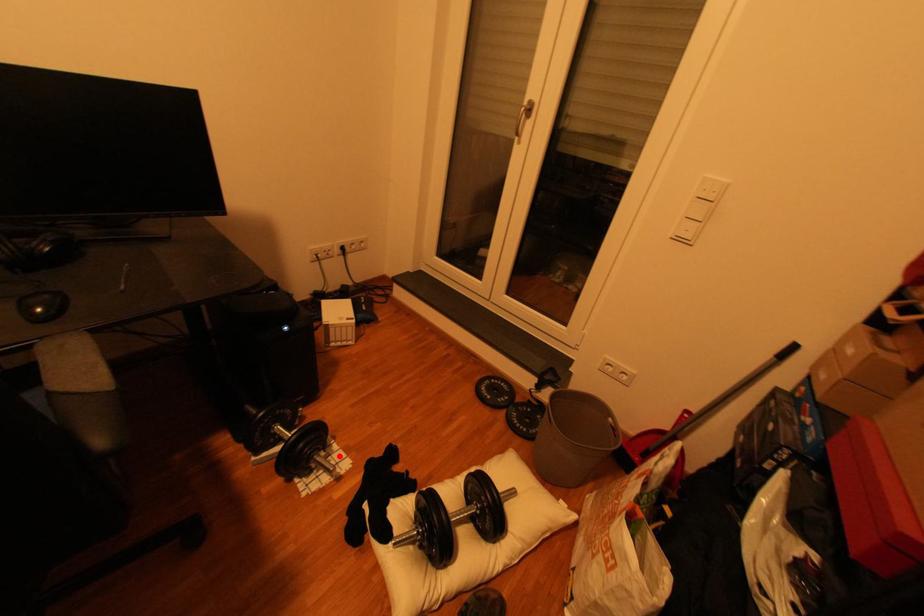
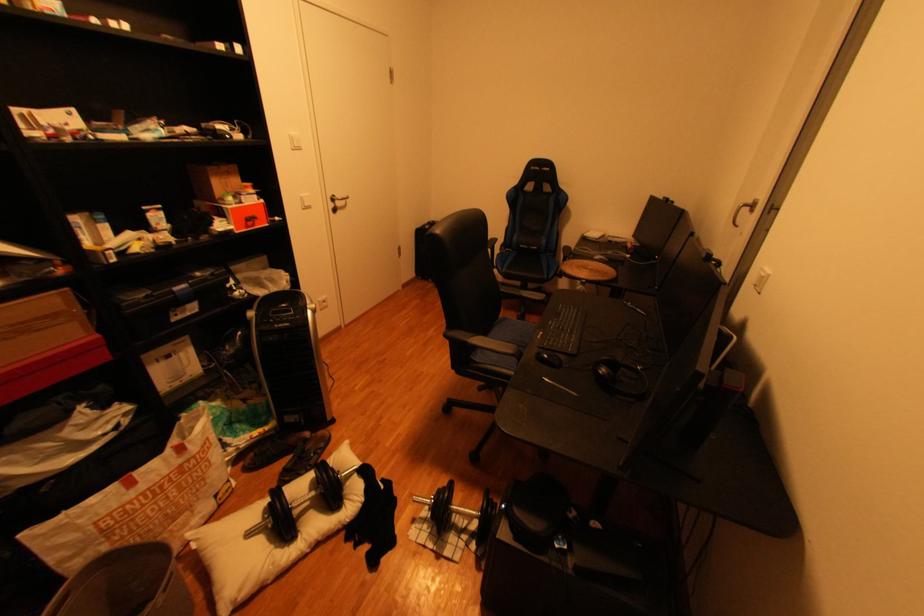
Question: I am providing you with two images of the same scene from different viewpoints. In image1, a red point is highlighted. Considering the same 3D point in image2, which of the following is correct?

Choices:
 (A) It is closer
 (B) It is farther

Answer: (B)